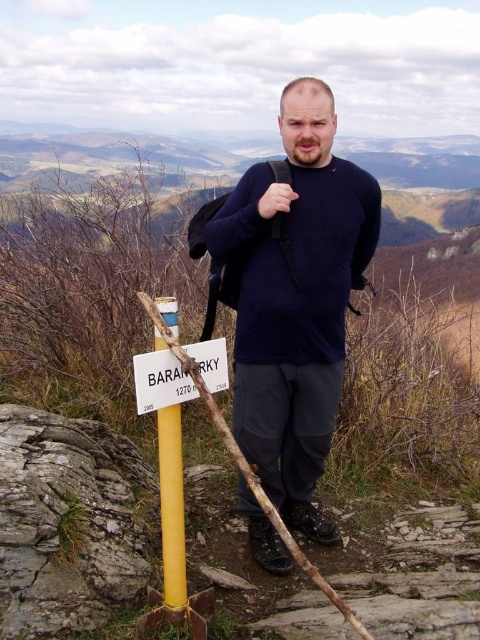
You are a hiker trying to determine which object is larger between the dark blue sweater at center and the white plastic sign at lower center. Based on the scene, which one is bigger?

The dark blue sweater at center is bigger than the white plastic sign at lower center.

You are a hiker standing at the point with coordinates point [210,355]. You want to move to the point with coordinates point [178,497]. Is the destination point in front of you or behind you?

The point [178,497] is in front of point [210,355], so the destination point is in front of you.

You are a photographer planning to take a photo of the hiker and the signpost. The camera is set to focus at 8 feet. Will the point at coordinates point (171, 468) be in focus?

The distance of point (171, 468) from camera is 8.47 feet. Since the camera is set to focus at 8 feet, the point is slightly farther away, so it may not be in focus.